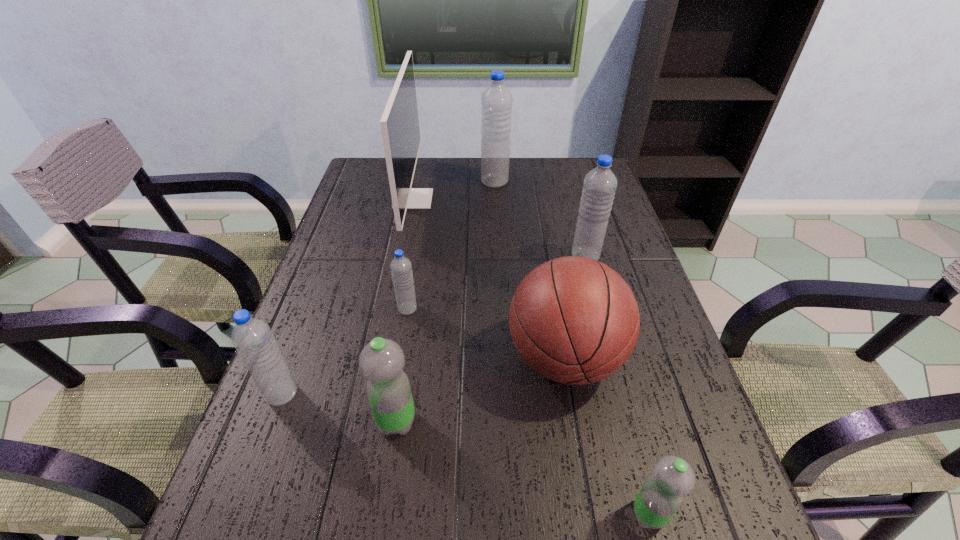
The height and width of the screenshot is (540, 960). In the image, there is a desktop. Identify the location of vacant space at the right edge. (714, 512).

The width and height of the screenshot is (960, 540). In the image, there is a desktop. Find the location of `vacant area at the far left corner`. vacant area at the far left corner is located at coordinates (361, 170).

Locate an element on the screen. This screenshot has height=540, width=960. vacant space at the far right corner of the desktop is located at coordinates (574, 183).

Where is `free space between the rightmost blue water bottle and the black monitor`? The height and width of the screenshot is (540, 960). free space between the rightmost blue water bottle and the black monitor is located at coordinates (499, 227).

The height and width of the screenshot is (540, 960). Identify the location of vacant point located between the basketball and the nearest blue water bottle. (423, 376).

Where is `free space between the second farthest blue water bottle and the smaller green water bottle`? Image resolution: width=960 pixels, height=540 pixels. free space between the second farthest blue water bottle and the smaller green water bottle is located at coordinates (617, 386).

What are the coordinates of `free spot between the black monitor and the basketball` in the screenshot? It's located at (489, 279).

This screenshot has width=960, height=540. What are the coordinates of `vacant area that lies between the basketball and the monitor` in the screenshot? It's located at (489, 279).

What are the coordinates of `free spot between the farther green water bottle and the leftmost object` in the screenshot? It's located at (340, 408).

At what (x,y) coordinates should I click in order to perform the action: click on vacant point located between the bigger green water bottle and the fifth shortest water bottle. Please return your answer as a coordinate pair (x, y). Looking at the image, I should click on (491, 339).